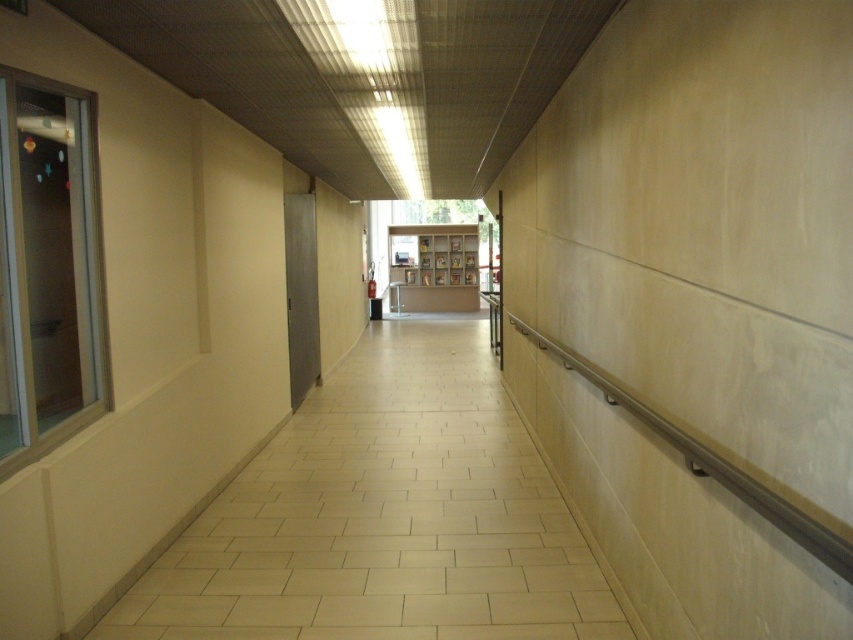
Question: Where is white tile floor at center located in relation to white matte bookshelf at center in the image?

Choices:
 (A) right
 (B) left

Answer: (B)

Question: Is white tile floor at center to the left of white matte bookshelf at center from the viewer's perspective?

Choices:
 (A) yes
 (B) no

Answer: (A)

Question: Is white tile floor at center bigger than white matte bookshelf at center?

Choices:
 (A) yes
 (B) no

Answer: (B)